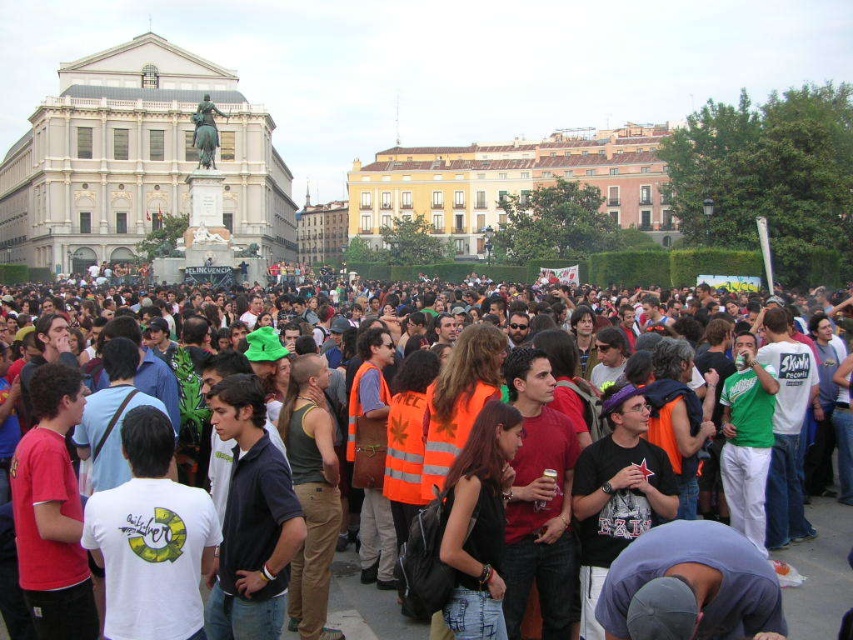
Question: Which object is positioned closest to the yellow brick building at upper center?

Choices:
 (A) white marble palace at upper left
 (B) orange reflective vests at center

Answer: (B)

Question: Can you confirm if yellow brick building at upper center is positioned below orange reflective vests at center?

Choices:
 (A) no
 (B) yes

Answer: (A)

Question: Is white marble palace at upper left positioned behind yellow brick building at upper center?

Choices:
 (A) yes
 (B) no

Answer: (B)

Question: Does white marble palace at upper left appear over orange reflective vests at center?

Choices:
 (A) yes
 (B) no

Answer: (A)

Question: Which object is the closest to the white marble palace at upper left?

Choices:
 (A) yellow brick building at upper center
 (B) orange reflective vests at center

Answer: (B)

Question: Based on their relative distances, which object is nearer to the orange reflective vests at center?

Choices:
 (A) yellow brick building at upper center
 (B) white marble palace at upper left

Answer: (A)